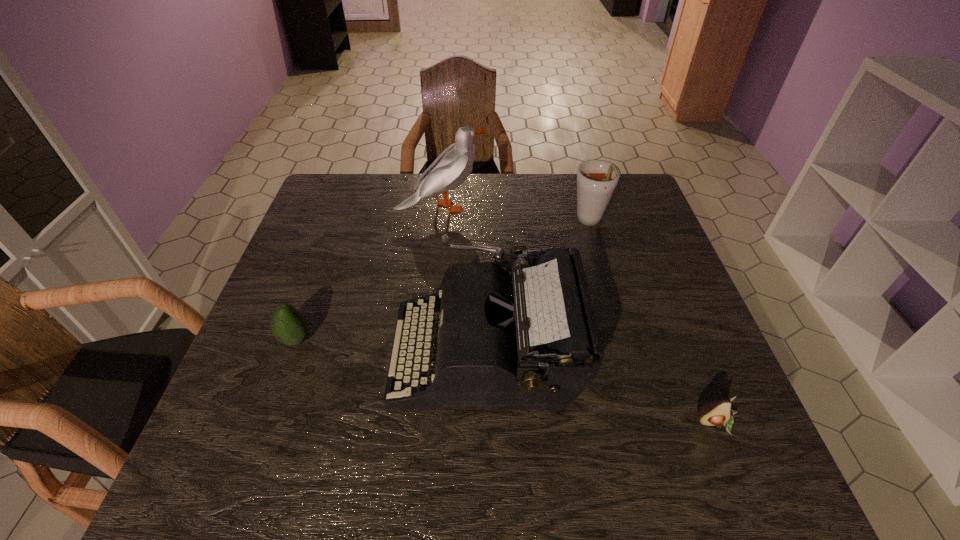
The width and height of the screenshot is (960, 540). What are the coordinates of `gull` in the screenshot? It's located at (452, 167).

Identify the location of the fourth object from left to right. (596, 179).

I want to click on typewriter, so 527,341.

This screenshot has height=540, width=960. In order to click on the leftmost object in this screenshot , I will do `click(288, 325)`.

You are a GUI agent. You are given a task and a screenshot of the screen. Output one action in this format:
    pyautogui.click(x=<x>, y=<y>)
    Task: Click on the farther avocado
    
    Given the screenshot: What is the action you would take?
    pyautogui.click(x=288, y=325)

Find the location of a particular element. the right avocado is located at coordinates (718, 412).

Locate an element on the screen. This screenshot has height=540, width=960. the rightmost object is located at coordinates (718, 412).

The height and width of the screenshot is (540, 960). Find the location of `vacant space located at the beak of the gull`. vacant space located at the beak of the gull is located at coordinates (521, 207).

Where is `blank space located 0.140m on the drink side of the fourth object from left to right`? blank space located 0.140m on the drink side of the fourth object from left to right is located at coordinates (605, 274).

The width and height of the screenshot is (960, 540). Find the location of `free space located on the front-facing side of the typewriter`. free space located on the front-facing side of the typewriter is located at coordinates (281, 353).